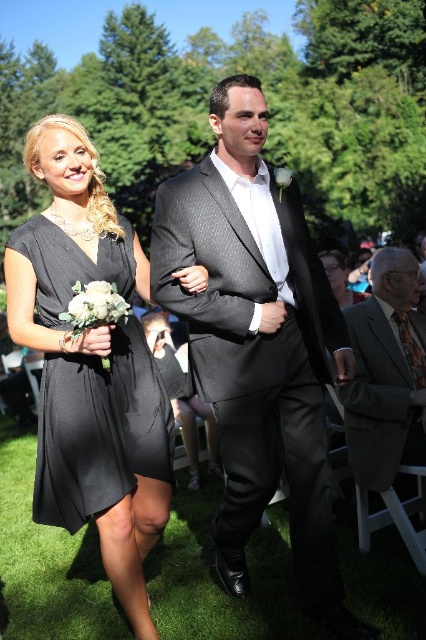
How much distance is there between charcoal textured suit at center and matte black dress at lower center?

charcoal textured suit at center is 1.61 meters from matte black dress at lower center.

Who is positioned more to the left, charcoal textured suit at center or matte black dress at lower center?

From the viewer's perspective, charcoal textured suit at center appears more on the left side.

This screenshot has width=426, height=640. I want to click on charcoal textured suit at center, so [258, 342].

Between black satin dress at center and matte black dress at lower center, which one has more height?

Standing taller between the two is black satin dress at center.

How distant is black satin dress at center from matte black dress at lower center?

black satin dress at center is 6.59 feet from matte black dress at lower center.

Is point (170, 481) behind point (365, 292)?

No, (170, 481) is in front of (365, 292).

Find the location of a particular element. black satin dress at center is located at coordinates point(100,429).

Does pinstriped suit at right appear on the right side of matte black dress at lower center?

No, pinstriped suit at right is not to the right of matte black dress at lower center.

Which is behind, point (374, 417) or point (365, 296)?

The point (365, 296) is more distant.

Which is behind, point (354, 385) or point (337, 292)?

The point (337, 292) is behind.

The width and height of the screenshot is (426, 640). I want to click on pinstriped suit at right, so point(385,374).